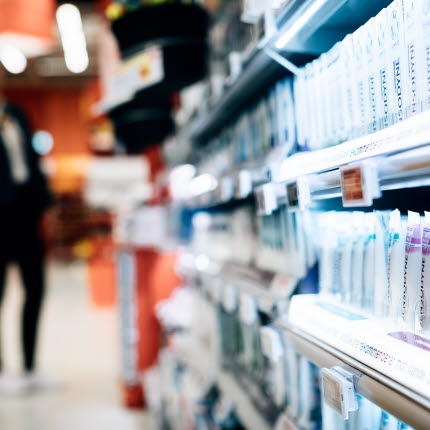
I want to click on floor, so click(97, 361).